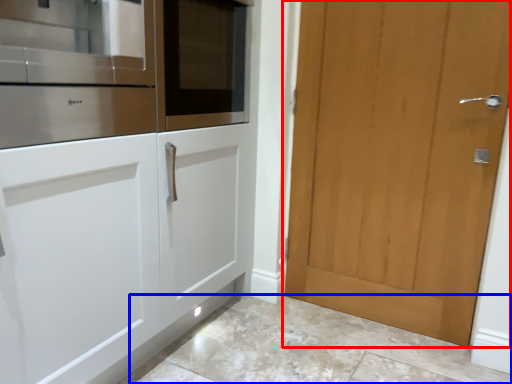
Question: Which object appears closest to the camera in this image, door (highlighted by a red box) or granite (highlighted by a blue box)?

Choices:
 (A) door
 (B) granite

Answer: (B)